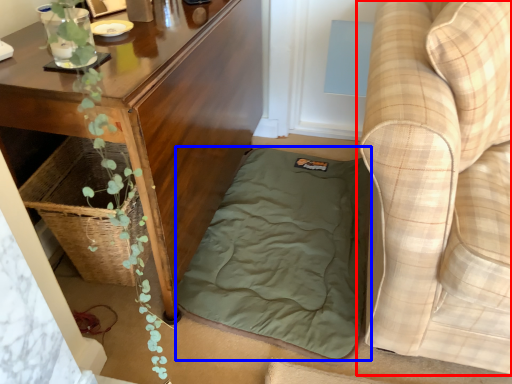
Question: Which object appears closest to the camera in this image, studio couch (highlighted by a red box) or mattress (highlighted by a blue box)?

Choices:
 (A) studio couch
 (B) mattress

Answer: (A)